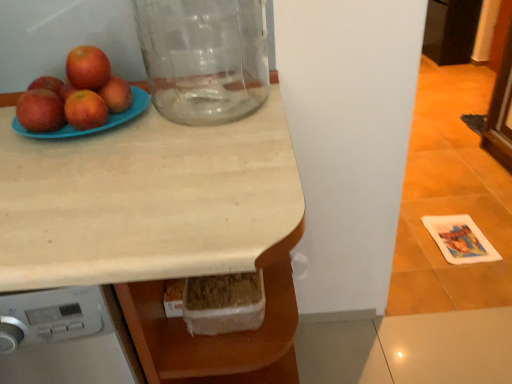
The width and height of the screenshot is (512, 384). I want to click on vacant area located to the right-hand side of glossy red apple at left, which is the first apple from left to right, so click(116, 116).